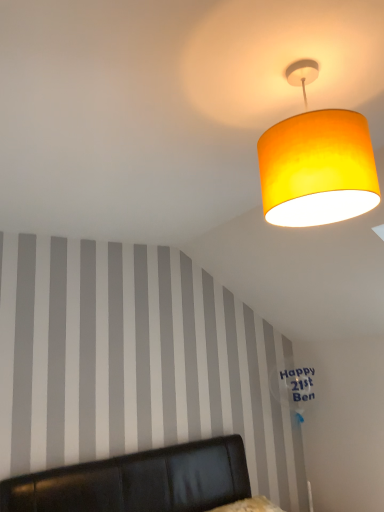
Question: Is matte yellow fabric lampshade at upper right in front of black leather headboard at lower center?

Choices:
 (A) no
 (B) yes

Answer: (A)

Question: Is matte yellow fabric lampshade at upper right positioned with its back to black leather headboard at lower center?

Choices:
 (A) no
 (B) yes

Answer: (A)

Question: Considering the relative sizes of matte yellow fabric lampshade at upper right and black leather headboard at lower center in the image provided, is matte yellow fabric lampshade at upper right taller than black leather headboard at lower center?

Choices:
 (A) no
 (B) yes

Answer: (A)

Question: Considering the relative sizes of matte yellow fabric lampshade at upper right and black leather headboard at lower center in the image provided, is matte yellow fabric lampshade at upper right bigger than black leather headboard at lower center?

Choices:
 (A) no
 (B) yes

Answer: (A)

Question: Would you say matte yellow fabric lampshade at upper right contains black leather headboard at lower center?

Choices:
 (A) no
 (B) yes

Answer: (A)

Question: From a real-world perspective, does matte yellow fabric lampshade at upper right sit lower than black leather headboard at lower center?

Choices:
 (A) yes
 (B) no

Answer: (B)

Question: Can you confirm if black leather headboard at lower center is positioned to the left of matte yellow fabric lampshade at upper right?

Choices:
 (A) no
 (B) yes

Answer: (B)

Question: From a real-world perspective, is black leather headboard at lower center on matte yellow fabric lampshade at upper right?

Choices:
 (A) yes
 (B) no

Answer: (B)

Question: From the image's perspective, is black leather headboard at lower center located beneath matte yellow fabric lampshade at upper right?

Choices:
 (A) yes
 (B) no

Answer: (A)

Question: Is black leather headboard at lower center oriented away from matte yellow fabric lampshade at upper right?

Choices:
 (A) yes
 (B) no

Answer: (B)

Question: Is black leather headboard at lower center surrounding matte yellow fabric lampshade at upper right?

Choices:
 (A) yes
 (B) no

Answer: (B)

Question: Considering the relative sizes of black leather headboard at lower center and matte yellow fabric lampshade at upper right in the image provided, is black leather headboard at lower center bigger than matte yellow fabric lampshade at upper right?

Choices:
 (A) no
 (B) yes

Answer: (B)

Question: In terms of width, does black leather headboard at lower center look wider or thinner when compared to matte yellow fabric lampshade at upper right?

Choices:
 (A) wide
 (B) thin

Answer: (A)